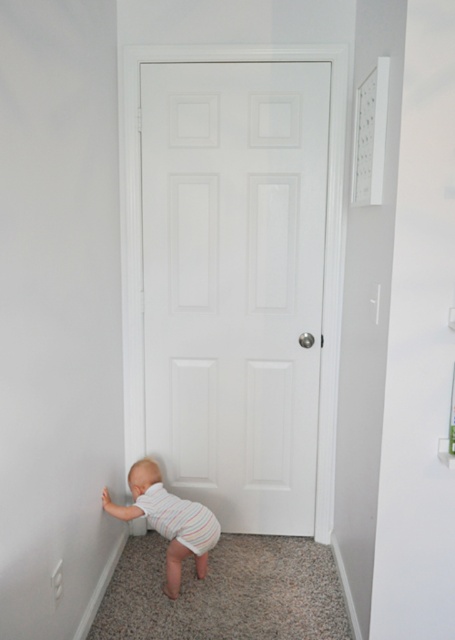
You are a parent trying to ensure your baby stays safe in the hallway. The baby is crawling towards the white matte door at center and the striped cotton diaper at lower left. Based on their sizes, which object is more likely to block the baby from moving past it?

The white matte door at center is larger than the striped cotton diaper at lower left, so it is more likely to block the baby from moving past it.

You are a parent trying to ensure your baby stays safe while crawling in the hallway. The white matte door at center is in the way. Can the striped cotton onesie at lower left fit through the space between the door and the wall without getting stuck?

The white matte door at center is wider than the striped cotton onesie at lower left, so the baby in the striped cotton onesie at lower left can fit through the space between the door and the wall without getting stuck since the door is wider than the onesie.

You are a parent trying to reach your baby crawling towards the door. The baby is at point (165, 528). You are standing 2 meters away from the door. Can you reach the baby before they reach the door?

The point where the baby is located is 2.46 meters away from the camera. Since you are only 2 meters away from the door, you are closer to the baby than the door is. Therefore, you can reach the baby before they reach the door.